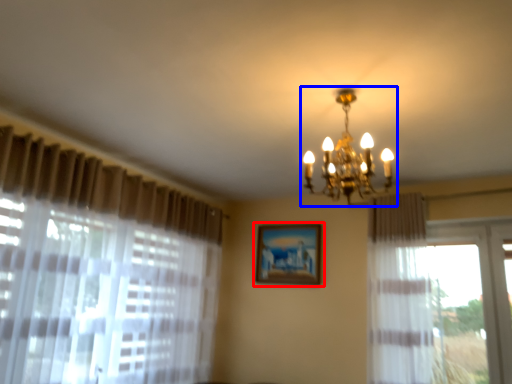
Question: Among these objects, which one is farthest to the camera, picture frame (highlighted by a red box) or lamp (highlighted by a blue box)?

Choices:
 (A) picture frame
 (B) lamp

Answer: (A)